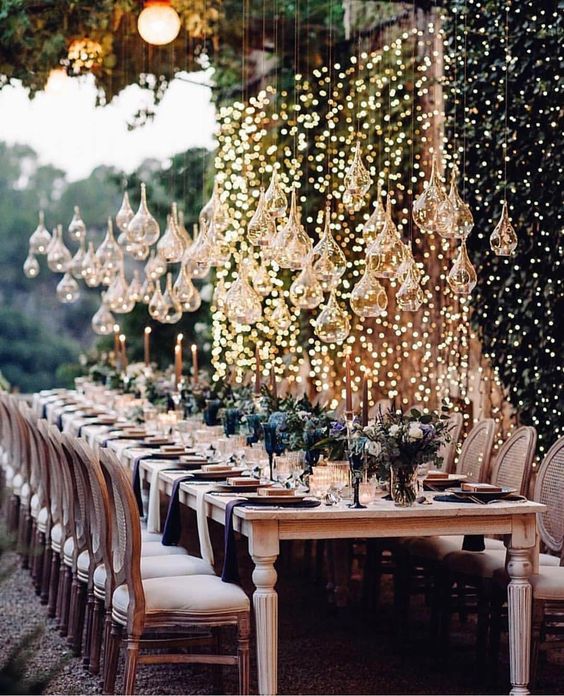
I want to click on wooden table, so click(320, 525).